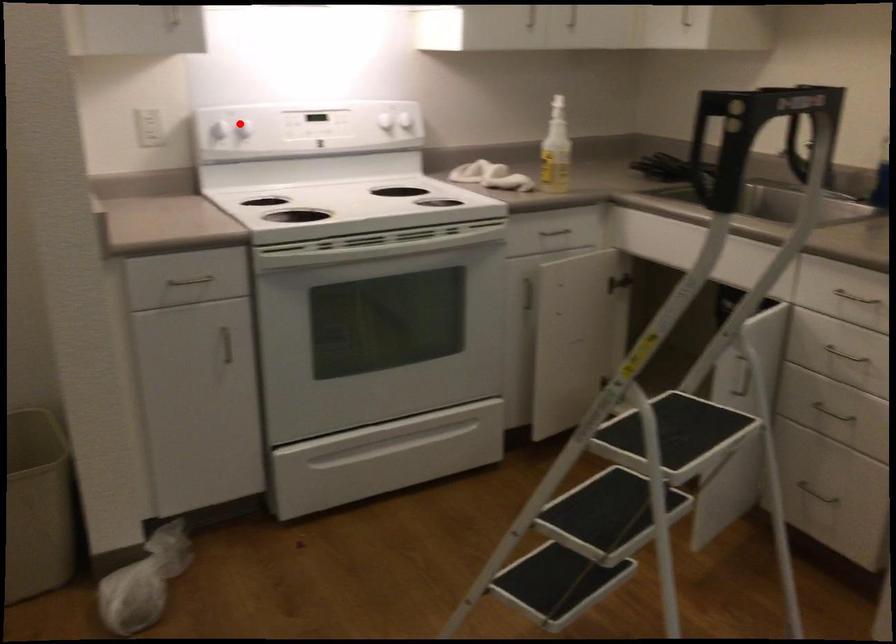
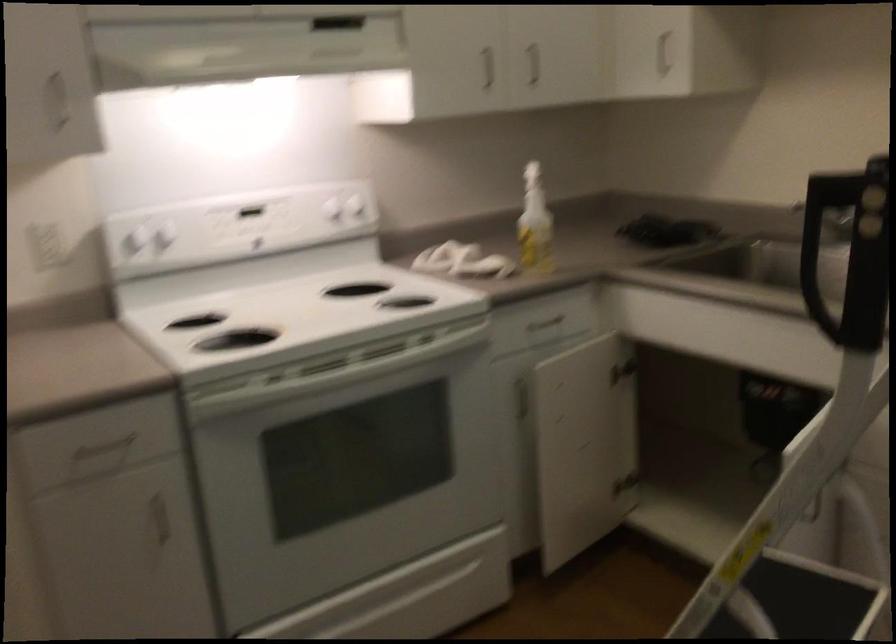
In the second image, find the point that corresponds to the highlighted location in the first image.

(165, 238)